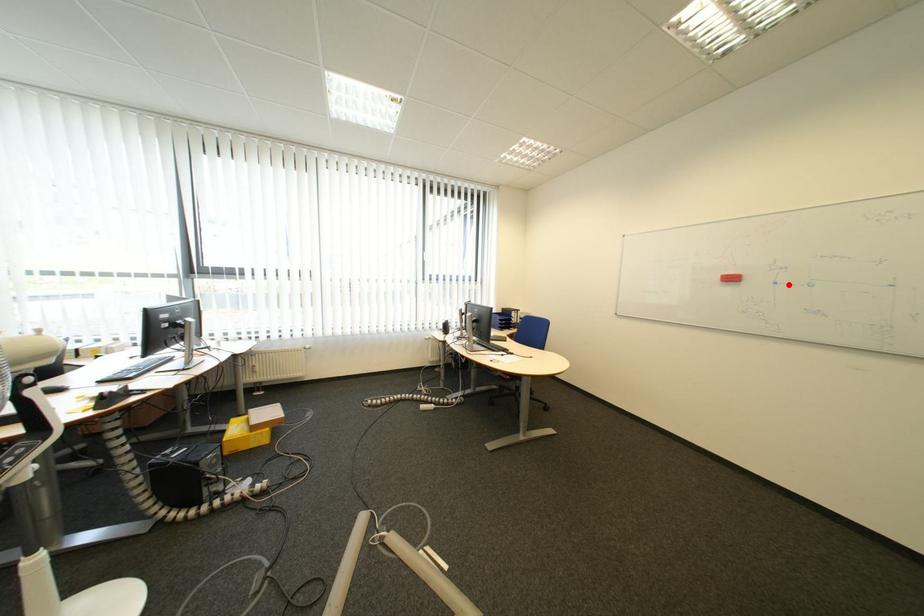
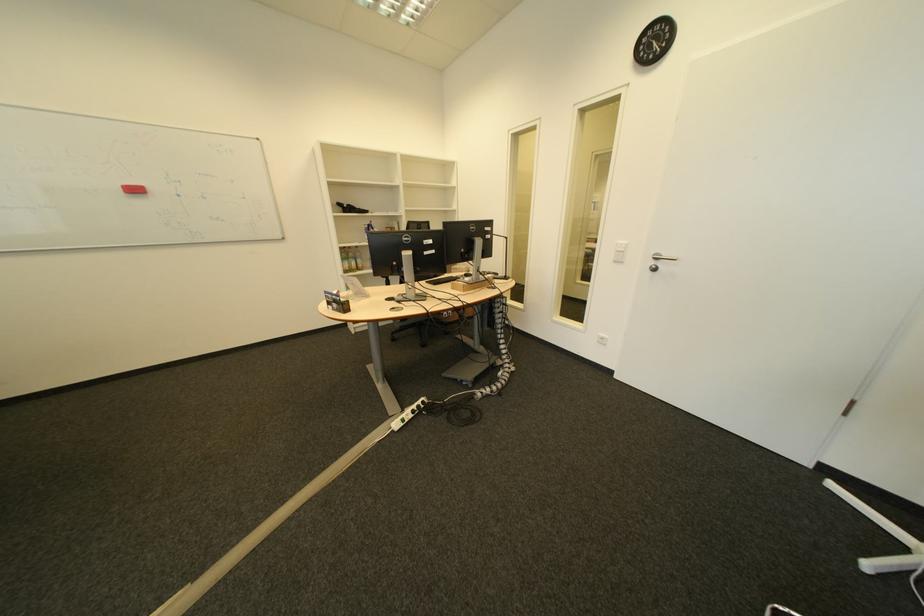
In the second image, find the point that corresponds to the highlighted location in the first image.

(192, 197)